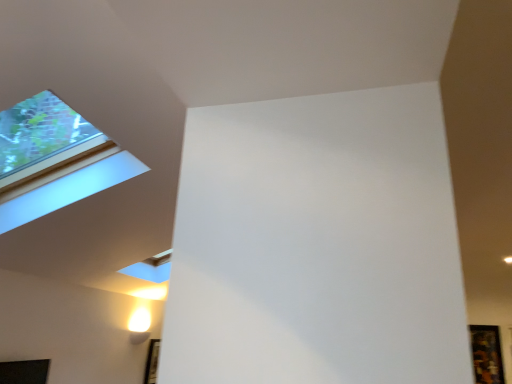
Describe the element at coordinates (54, 160) in the screenshot. I see `clear glass window at upper left` at that location.

The image size is (512, 384). I want to click on clear glass window at upper left, so click(x=54, y=160).

Locate an element on the screen. The width and height of the screenshot is (512, 384). clear glass window at upper left is located at coordinates (54, 160).